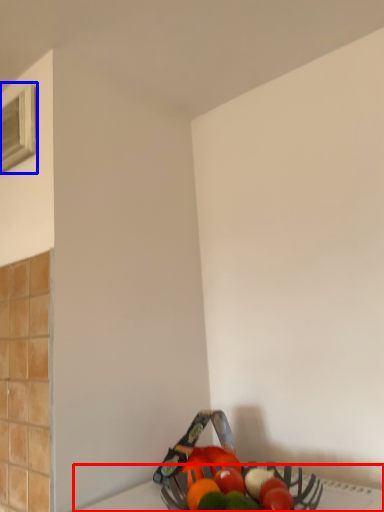
Question: Which object is closer to the camera taking this photo, table top (highlighted by a red box) or window (highlighted by a blue box)?

Choices:
 (A) table top
 (B) window

Answer: (A)